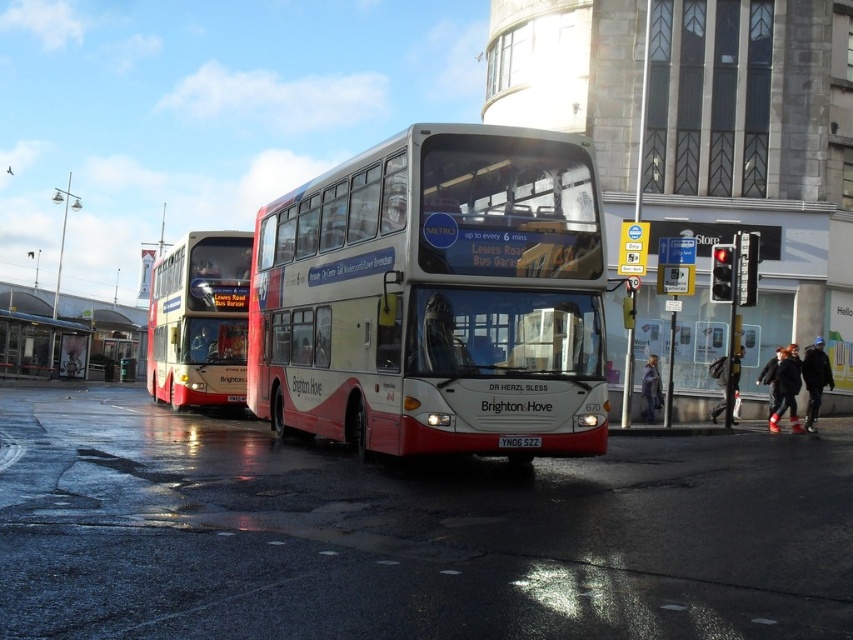
From the picture: You are a pedestrian trying to cross the street to reach the bus stop. You see the matte red bus at left and the metallic bus stop at lower left. Which object is bigger in size?

The matte red bus at left is larger in size compared to the metallic bus stop at lower left.

You are a delivery person with a cart that is 2 meters wide. You need to move from the matte red bus at left to the metallic bus stop at lower left. Is there enough space between them for your cart to pass through?

The matte red bus at left is 10.38 meters from the metallic bus stop at lower left. Since your cart is only 2 meters wide, there is ample space for you to maneuver between them without any issues.

You are a pedestrian standing at the bus stop and want to board the white glossy bus at center. The license plate yellow matte license plate at center is required for verification. Is the license plate positioned in a way that you can see it clearly while boarding the bus?

The white glossy bus at center is to the left of the yellow matte license plate at center, so the license plate is on the right side of the bus. Since you are boarding from the left side, you might not be able to see the license plate clearly while boarding the bus.